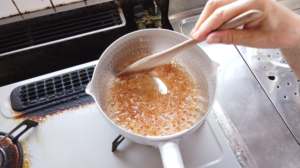
Find the location of a particular element. bowl is located at coordinates (107, 61).